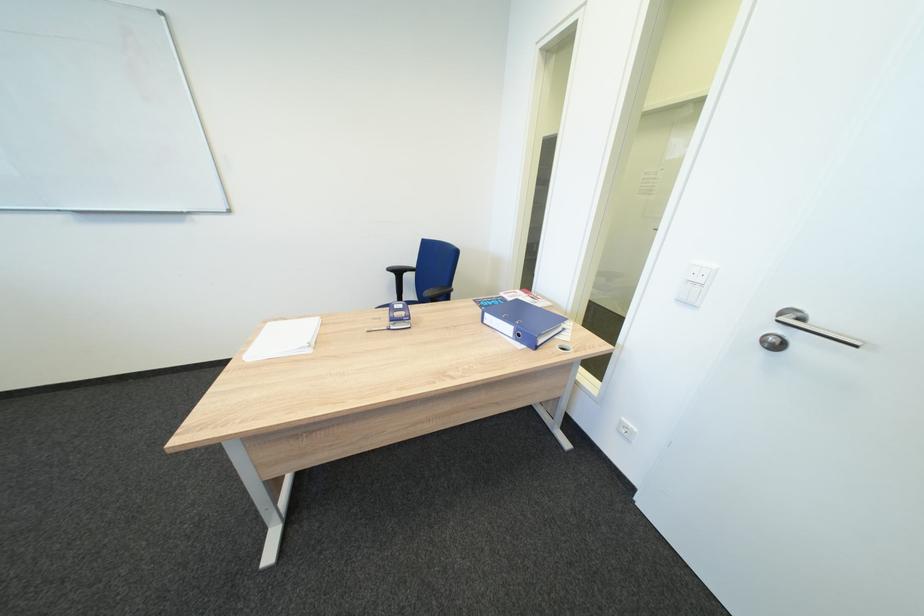
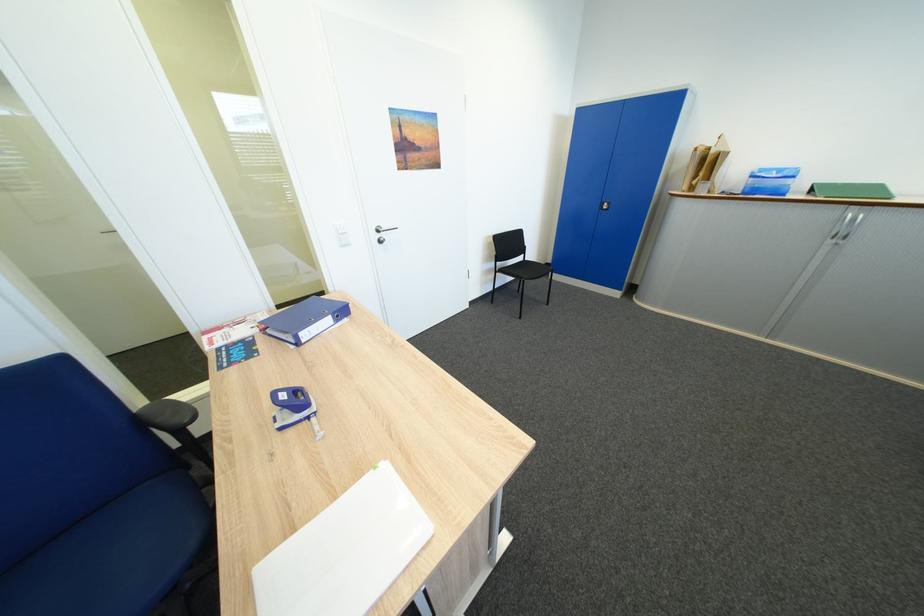
In the second image, find the point that corresponds to [496,315] in the first image.

(310, 334)